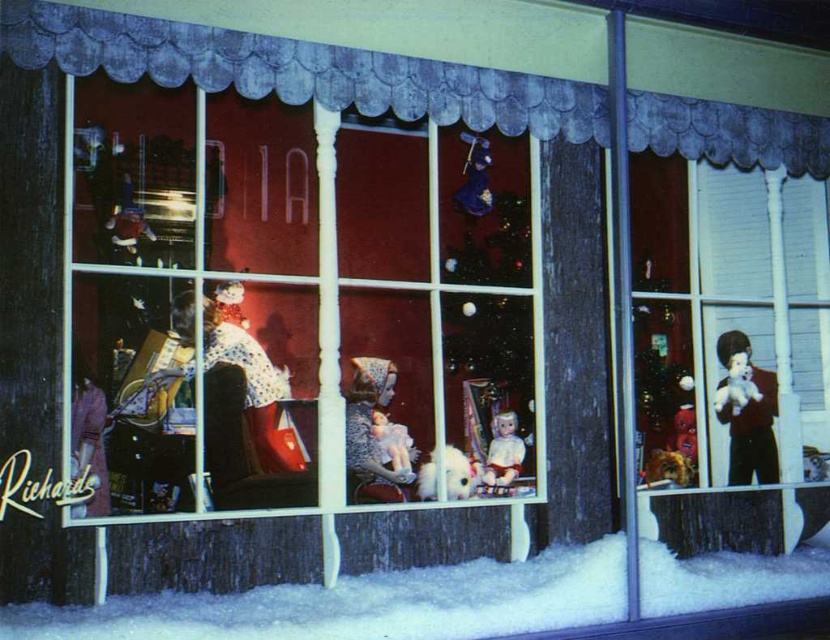
Is point (139, 595) positioned before point (489, 464)?

Yes, point (139, 595) is closer to viewer.

Is white fluffy snow at lower center shorter than white plush doll at center?

No.

The width and height of the screenshot is (830, 640). In order to click on white fluffy snow at lower center in this screenshot , I will do `click(364, 604)`.

Which is in front, point (498, 467) or point (464, 497)?

Point (464, 497) is more forward.

Is point (503, 412) closer to viewer compared to point (432, 476)?

No.

Does point (510, 444) come farther from viewer compared to point (443, 458)?

Yes.

This screenshot has width=830, height=640. I want to click on white plush doll at center, so click(x=503, y=451).

Which of these two, white fluffy snow at lower center or matte porcelain doll at center, stands taller?

white fluffy snow at lower center is taller.

Can you confirm if white fluffy snow at lower center is positioned below matte porcelain doll at center?

Yes.

Between point (752, 604) and point (399, 449), which one is positioned in front?

Point (752, 604) is in front.

Where is `white fluffy snow at lower center`? white fluffy snow at lower center is located at coordinates (364, 604).